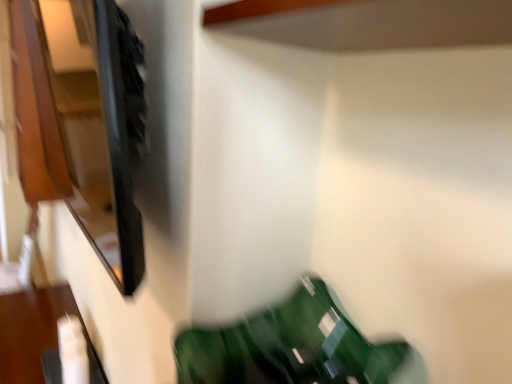
The height and width of the screenshot is (384, 512). What do you see at coordinates (33, 334) in the screenshot?
I see `white glossy remote control at lower left` at bounding box center [33, 334].

This screenshot has height=384, width=512. In order to click on green glossy bean bag chair at lower center in this screenshot , I will do `click(294, 347)`.

Between matte black cabinet at upper left and green glossy bean bag chair at lower center, which one is positioned behind?

matte black cabinet at upper left is behind.

Based on their positions, is matte black cabinet at upper left located to the left or right of green glossy bean bag chair at lower center?

Clearly, matte black cabinet at upper left is on the left of green glossy bean bag chair at lower center in the image.

Is matte black cabinet at upper left oriented towards green glossy bean bag chair at lower center?

No.

From the image's perspective, which one is positioned higher, green glossy bean bag chair at lower center or matte black cabinet at upper left?

From the image's view, matte black cabinet at upper left is above.

From a real-world perspective, is green glossy bean bag chair at lower center on top of matte black cabinet at upper left?

No, from a real-world perspective, green glossy bean bag chair at lower center is not over matte black cabinet at upper left

From the picture: Which is correct: green glossy bean bag chair at lower center is inside matte black cabinet at upper left, or outside of it?

green glossy bean bag chair at lower center is located beyond the bounds of matte black cabinet at upper left.

Which of these two, green glossy bean bag chair at lower center or matte black cabinet at upper left, is smaller?

green glossy bean bag chair at lower center.

Which is in front, point (21, 380) or point (349, 363)?

The point (349, 363) is closer.

Is white glossy remote control at lower left directly adjacent to green glossy bean bag chair at lower center?

No, white glossy remote control at lower left is not making contact with green glossy bean bag chair at lower center.

Is green glossy bean bag chair at lower center inside white glossy remote control at lower left?

No, green glossy bean bag chair at lower center is not surrounded by white glossy remote control at lower left.

Is white glossy remote control at lower left at the right side of green glossy bean bag chair at lower center?

No, white glossy remote control at lower left is not to the right of green glossy bean bag chair at lower center.

Where is `furniture below the green glossy bean bag chair at lower center (from a real-world perspective)`? furniture below the green glossy bean bag chair at lower center (from a real-world perspective) is located at coordinates (33, 334).

Considering the points (377, 354) and (47, 319), which point is in front, point (377, 354) or point (47, 319)?

Point (377, 354)

Would you say green glossy bean bag chair at lower center is to the left or to the right of white glossy remote control at lower left in the picture?

green glossy bean bag chair at lower center is to the right of white glossy remote control at lower left.

Is matte black cabinet at upper left not near white glossy remote control at lower left?

matte black cabinet at upper left is positioned a significant distance from white glossy remote control at lower left.

Would you say matte black cabinet at upper left is outside white glossy remote control at lower left?

Yes.

Is matte black cabinet at upper left in front of white glossy remote control at lower left?

Yes, it is.

In the image, is white glossy remote control at lower left positioned in front of or behind matte black cabinet at upper left?

Clearly, white glossy remote control at lower left is behind matte black cabinet at upper left.

Is matte black cabinet at upper left inside white glossy remote control at lower left?

No, matte black cabinet at upper left is not a part of white glossy remote control at lower left.

Which is more to the right, white glossy remote control at lower left or matte black cabinet at upper left?

From the viewer's perspective, matte black cabinet at upper left appears more on the right side.

Are white glossy remote control at lower left and matte black cabinet at upper left located far from each other?

Yes, white glossy remote control at lower left and matte black cabinet at upper left are located far from each other.

You are a GUI agent. You are given a task and a screenshot of the screen. Output one action in this format:
    pyautogui.click(x=<x>, y=<y>)
    Task: Click on the bean bag chair located in front of the matte black cabinet at upper left
    This screenshot has width=512, height=384.
    Given the screenshot: What is the action you would take?
    pyautogui.click(x=294, y=347)

At what (x,y) coordinates should I click in order to perform the action: click on bean bag chair on the right of matte black cabinet at upper left. Please return your answer as a coordinate pair (x, y). This screenshot has width=512, height=384. Looking at the image, I should click on (294, 347).

Based on their spatial positions, is green glossy bean bag chair at lower center or matte black cabinet at upper left closer to white glossy remote control at lower left?

green glossy bean bag chair at lower center.

Estimate the real-world distances between objects in this image. Which object is further from matte black cabinet at upper left, green glossy bean bag chair at lower center or white glossy remote control at lower left?

The object further to matte black cabinet at upper left is green glossy bean bag chair at lower center.

From the image, which object appears to be farther from white glossy remote control at lower left, matte black cabinet at upper left or green glossy bean bag chair at lower center?

matte black cabinet at upper left is positioned further to the anchor white glossy remote control at lower left.

When comparing their distances from matte black cabinet at upper left, does white glossy remote control at lower left or green glossy bean bag chair at lower center seem closer?

white glossy remote control at lower left is positioned closer to the anchor matte black cabinet at upper left.

From the image, which object appears to be farther from green glossy bean bag chair at lower center, white glossy remote control at lower left or matte black cabinet at upper left?

Based on the image, matte black cabinet at upper left appears to be further to green glossy bean bag chair at lower center.

Which object lies further to the anchor point green glossy bean bag chair at lower center, matte black cabinet at upper left or white glossy remote control at lower left?

matte black cabinet at upper left lies further to green glossy bean bag chair at lower center than the other object.

Find the location of a particular element. The width and height of the screenshot is (512, 384). bean bag chair between matte black cabinet at upper left and white glossy remote control at lower left vertically is located at coordinates 294,347.